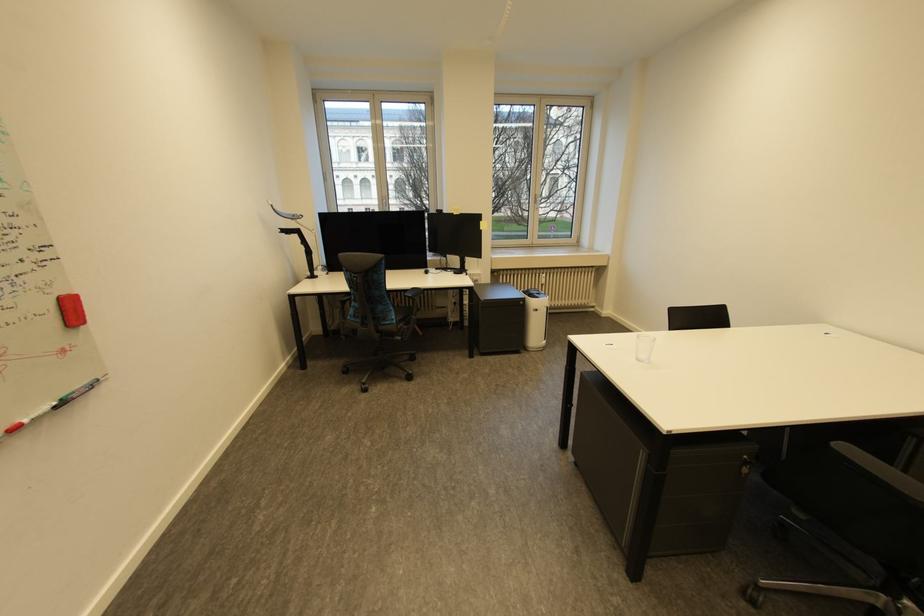
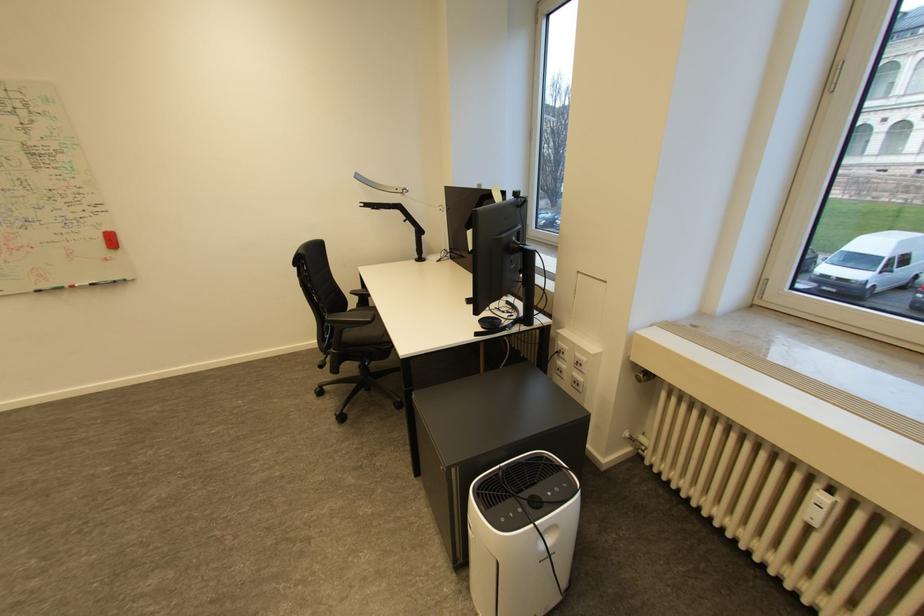
The point at (302, 237) is marked in the first image. Where is the corresponding point in the second image?

(405, 213)